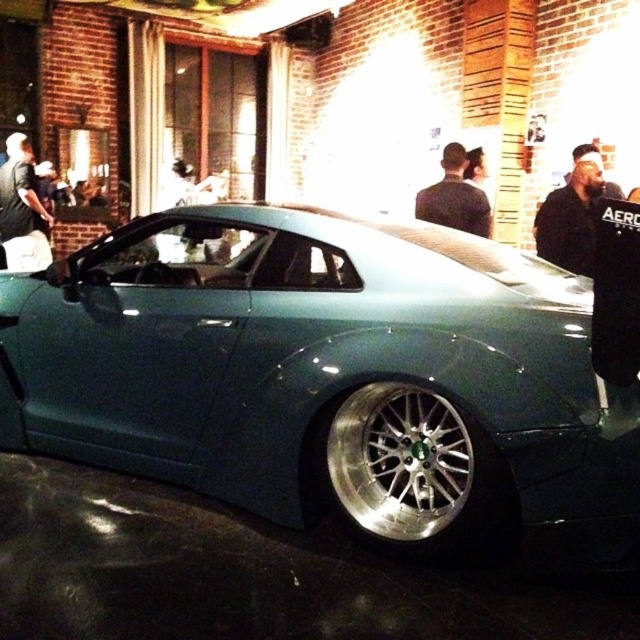
Does point (573, 173) come farther from viewer compared to point (26, 246)?

That is False.

Between point (561, 266) and point (22, 259), which one is positioned in front?

Point (561, 266) is in front.

The width and height of the screenshot is (640, 640). What are the coordinates of `black leather jacket at upper right` in the screenshot? It's located at (570, 220).

Does silver polished rim at lower center have a smaller size compared to black leather jacket at upper right?

Indeed, silver polished rim at lower center has a smaller size compared to black leather jacket at upper right.

Does silver polished rim at lower center have a lesser width compared to black leather jacket at upper right?

No.

Is point (378, 506) less distant than point (579, 209)?

Yes, point (378, 506) is in front of point (579, 209).

At what (x,y) coordinates should I click in order to perform the action: click on silver polished rim at lower center. Please return your answer as a coordinate pair (x, y). Looking at the image, I should click on (400, 460).

Which is below, black leather jacket at upper left or dark gray fabric jacket at upper center?

dark gray fabric jacket at upper center

Between point (12, 170) and point (472, 220), which one is positioned behind?

Point (12, 170)

Where is `black leather jacket at upper left`? This screenshot has height=640, width=640. black leather jacket at upper left is located at coordinates (20, 209).